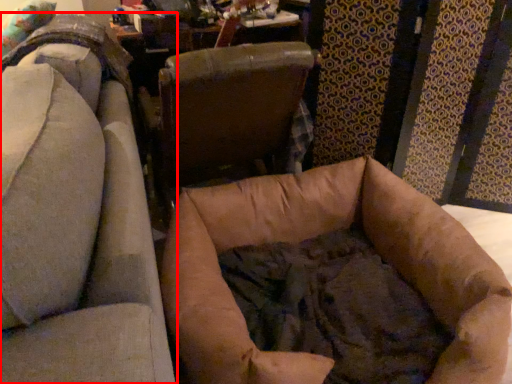
Question: From the image's perspective, where is chair (annotated by the red box) located relative to chair?

Choices:
 (A) above
 (B) below

Answer: (B)